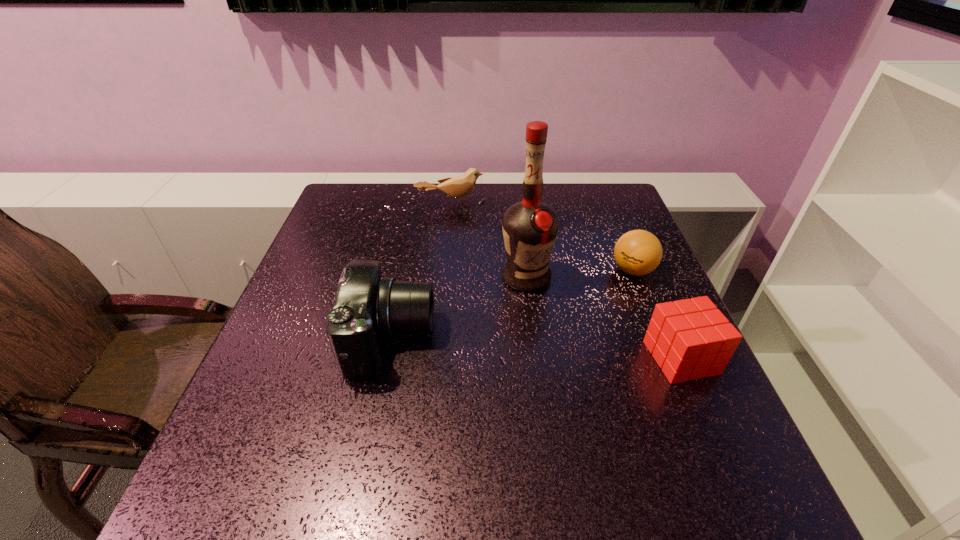
The image size is (960, 540). I want to click on camera, so click(367, 307).

Where is `cube`? cube is located at coordinates (690, 339).

Locate an element on the screen. ping-pong ball is located at coordinates (638, 252).

Find the location of a particular element. This screenshot has width=960, height=540. bird is located at coordinates (458, 187).

Find the location of a particular element. The image size is (960, 540). the third object from left to right is located at coordinates (530, 227).

Where is `the tallest object`? The image size is (960, 540). the tallest object is located at coordinates (530, 227).

I want to click on vacant space positioned on the lens of the fourth shortest object, so click(456, 339).

Identify the location of free space located 0.190m on the left of the cube. The image size is (960, 540). (555, 357).

Where is `vacant space located on the side with brand of the ping-pong ball`? vacant space located on the side with brand of the ping-pong ball is located at coordinates (547, 318).

Image resolution: width=960 pixels, height=540 pixels. What are the coordinates of `vacant area located on the side with brand of the ping-pong ball` in the screenshot? It's located at (583, 298).